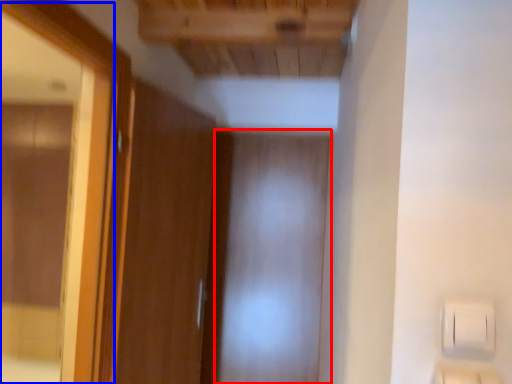
Question: Which object is further to the camera taking this photo, screen door (highlighted by a red box) or mirror (highlighted by a blue box)?

Choices:
 (A) screen door
 (B) mirror

Answer: (A)